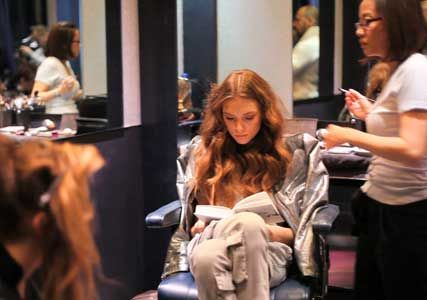
Find the location of `chair`. chair is located at coordinates (x=284, y=295).